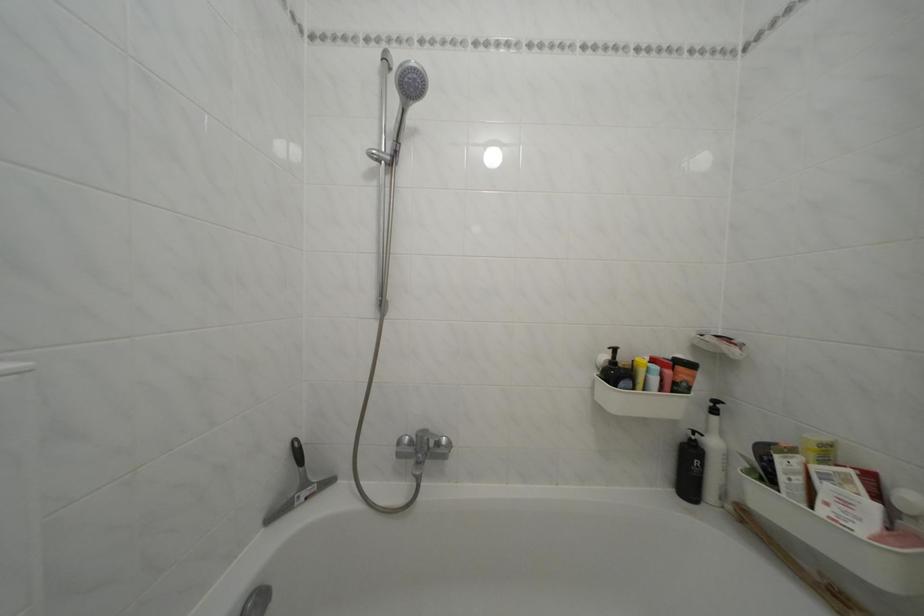
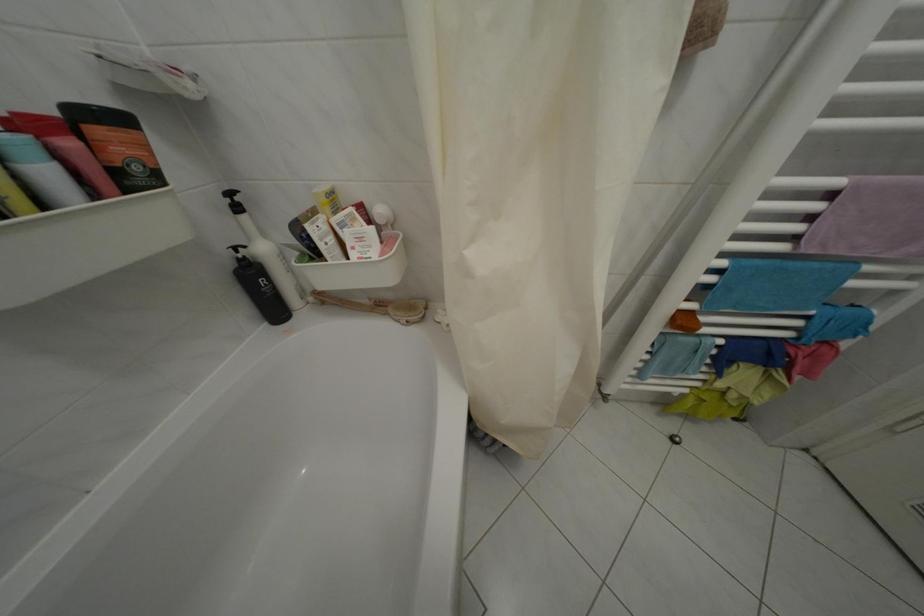
In the second image, find the point that corresponds to the point at 831,582 in the first image.

(379, 306)